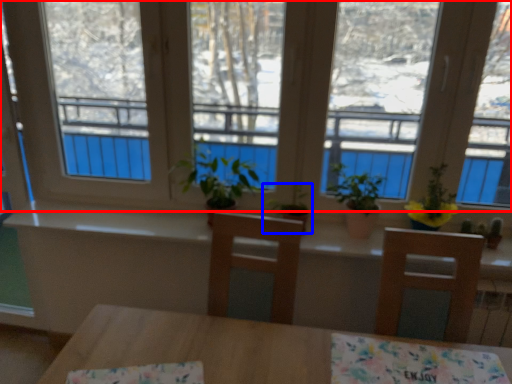
Question: Which of the following is the closest to the observer, window (highlighted by a red box) or houseplant (highlighted by a blue box)?

Choices:
 (A) window
 (B) houseplant

Answer: (A)